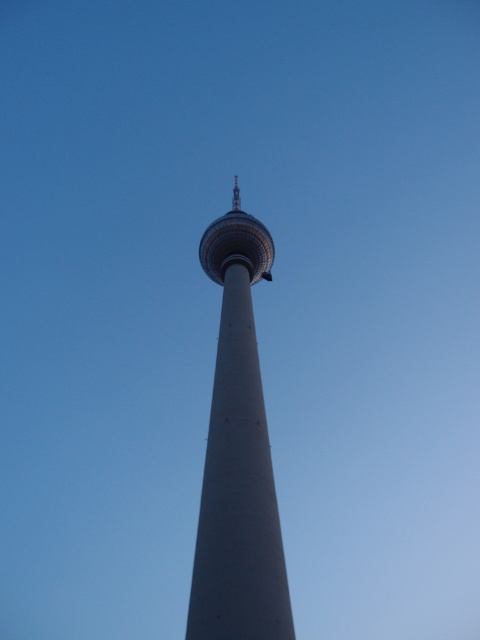
Question: Is smooth concrete tower at center smaller than sleek metallic tower at center?

Choices:
 (A) no
 (B) yes

Answer: (A)

Question: Can you confirm if smooth concrete tower at center is positioned to the left of sleek metallic tower at center?

Choices:
 (A) no
 (B) yes

Answer: (A)

Question: Which point is closer to the camera?

Choices:
 (A) smooth concrete tower at center
 (B) sleek metallic tower at center

Answer: (A)

Question: Which object appears closest to the camera in this image?

Choices:
 (A) smooth concrete tower at center
 (B) sleek metallic tower at center

Answer: (A)

Question: From the image, what is the correct spatial relationship of smooth concrete tower at center in relation to sleek metallic tower at center?

Choices:
 (A) right
 (B) left

Answer: (A)